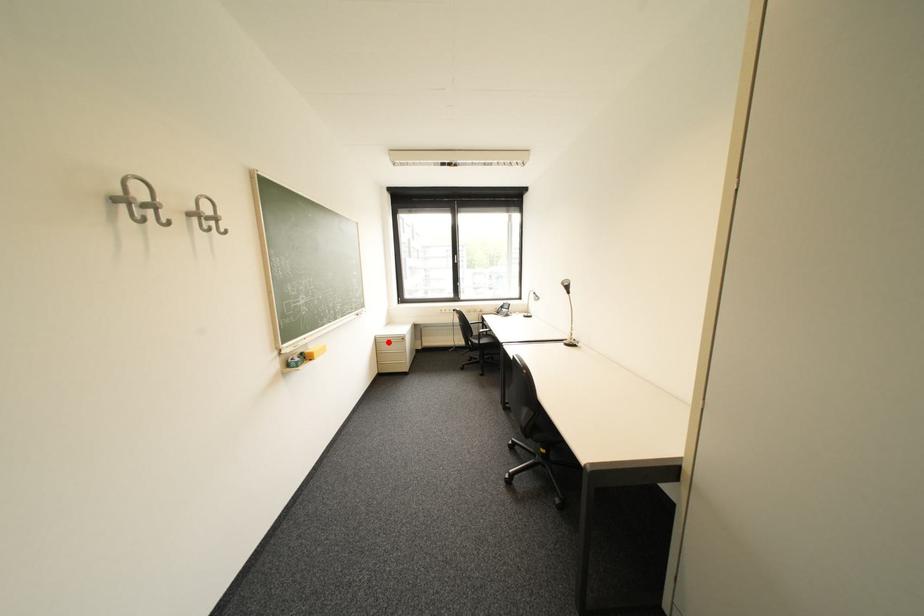
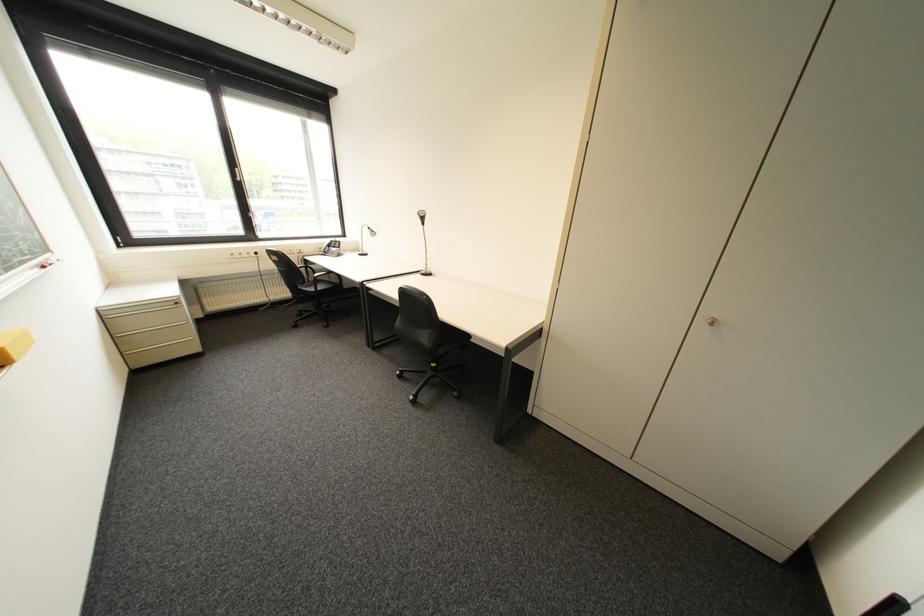
Find the pixel in the second image that matches the highlighted location in the first image.

(119, 318)